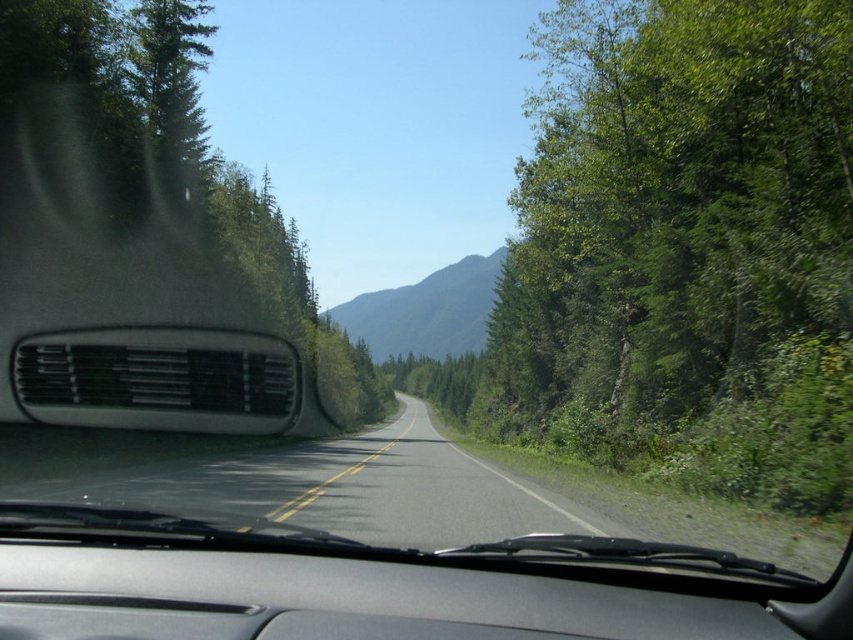
Does point (165, 144) lie behind point (370, 540)?

Yes, it is.

Looking at this image, can you confirm if green matte tree at left is bigger than black asphalt road at center?

Yes.

Describe the element at coordinates (144, 192) in the screenshot. Image resolution: width=853 pixels, height=640 pixels. I see `green matte tree at left` at that location.

Where is `green matte tree at left`? This screenshot has width=853, height=640. green matte tree at left is located at coordinates click(x=144, y=192).

Does green leafy tree at right have a lesser height compared to green forested mountain at center?

No.

Who is positioned more to the right, green leafy tree at right or green forested mountain at center?

Positioned to the right is green leafy tree at right.

Is point (660, 3) positioned in front of point (434, 294)?

Yes, point (660, 3) is in front of point (434, 294).

The height and width of the screenshot is (640, 853). I want to click on green leafy tree at right, so click(x=674, y=204).

Is green matte tree at left positioned at the back of green forested mountain at center?

No, green matte tree at left is closer to the viewer.

Is point (131, 230) positioned after point (463, 310)?

No, it is not.

The image size is (853, 640). Find the location of `green matte tree at left`. green matte tree at left is located at coordinates (144, 192).